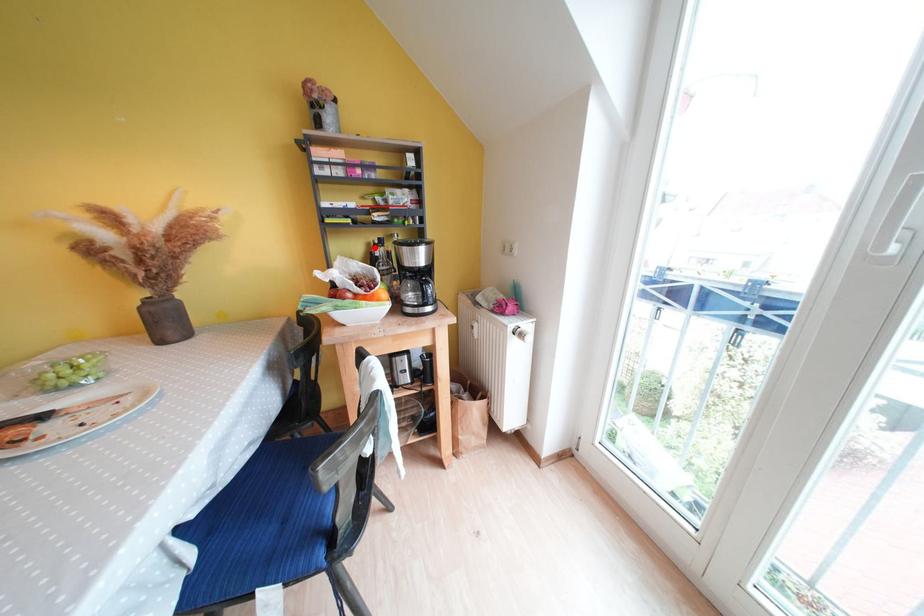
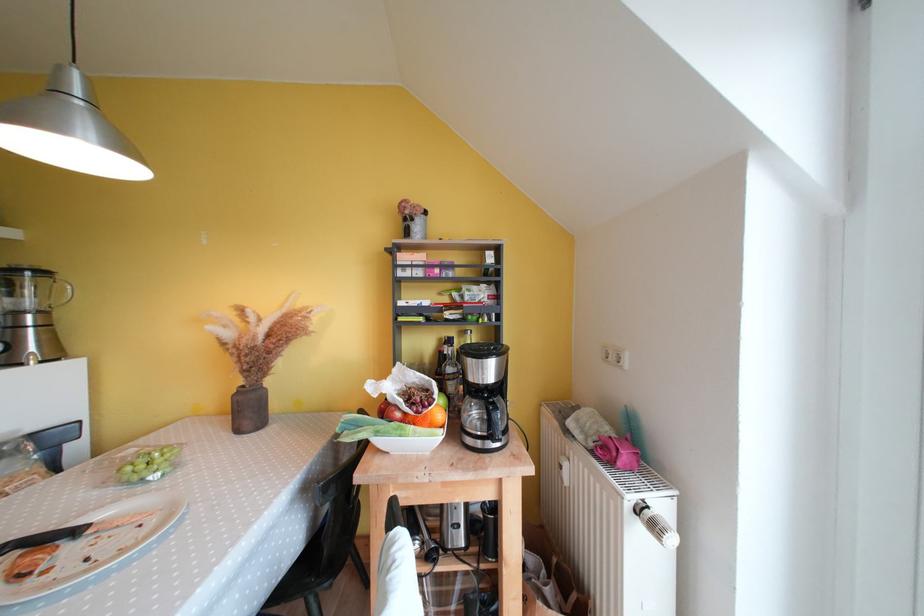
Locate, in the second image, the point that corresponds to the highlighted location in the first image.

(446, 342)